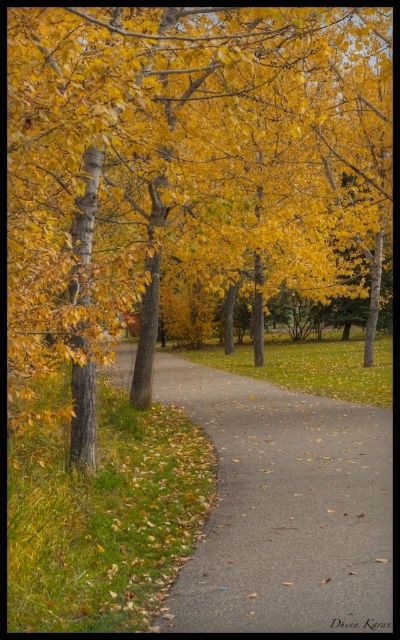
You are standing on the brown asphalt path at left and want to pick up the golden yellow leaves at center. Which direction should you move to reach them?

You should move to your right because the golden yellow leaves at center are located to the left of the brown asphalt path at left. Since you are on the path, moving right would take you towards the leaves.

You are a gardener trying to clear the pathway. You see golden yellow leaves at center and brown asphalt path at left. Which object is wider?

The golden yellow leaves at center might be wider than brown asphalt path at left according to the description.

You are a gardener planning to sweep the golden yellow leaves at center and the brown asphalt path at left. Which area requires a larger broom to handle effectively?

The golden yellow leaves at center requires a larger broom because it is larger in size than the brown asphalt path at left.